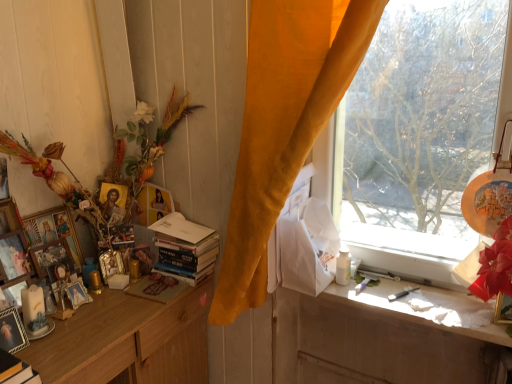
Locate an element on the screen. The width and height of the screenshot is (512, 384). vacant area that is in front of matte brown magazine at center is located at coordinates (132, 315).